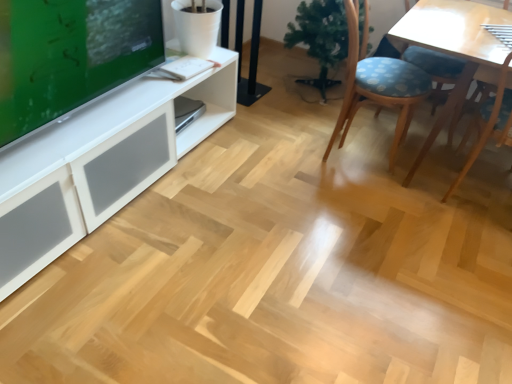
Question: From a real-world perspective, is green glossy tv at upper left above or below blue fabric chair at center-right?

Choices:
 (A) above
 (B) below

Answer: (A)

Question: Is green glossy tv at upper left taller or shorter than blue fabric chair at center-right?

Choices:
 (A) short
 (B) tall

Answer: (A)

Question: Which of these objects is positioned farthest from the green glossy tv at upper left?

Choices:
 (A) green matte artificial plant at center
 (B) blue fabric chair at center-right

Answer: (A)

Question: Based on their relative distances, which object is nearer to the green matte artificial plant at center?

Choices:
 (A) blue fabric chair at center-right
 (B) green glossy tv at upper left

Answer: (A)